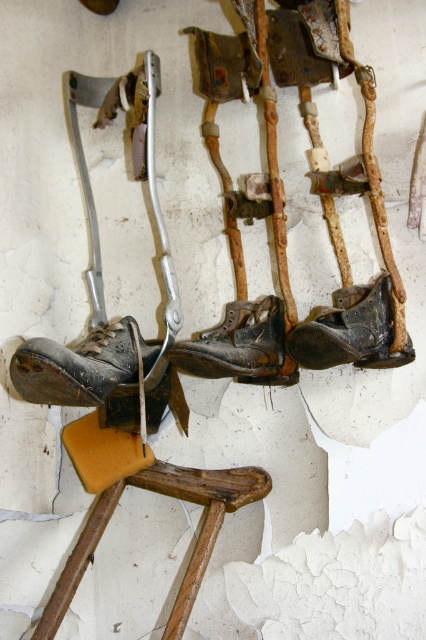
You are a delivery person who needs to place a new box that is 12 inches wide between the wooden at center and the shiny black leather shoe at center. Can the box fit in the space between them?

The distance between wooden at center and shiny black leather shoe at center is 11.43 inches. Since the box is 12 inches wide, it cannot fit in the space between them because the space is narrower than the box.

You are a physical therapist assessing the braces in the image. You need to determine which object is taller between the wooden at center and the leather boot at center. Which one is taller?

The wooden at center is much taller than the leather boot at center according to the description provided.

You are an antique collector examining the items hanging on the wall. You want to touch the wooden at center and the leather boot at center. Which one would you need to reach out further to touch?

The leather boot at center is further away from you than the wooden at center, so you would need to reach out further to touch the leather boot at center.